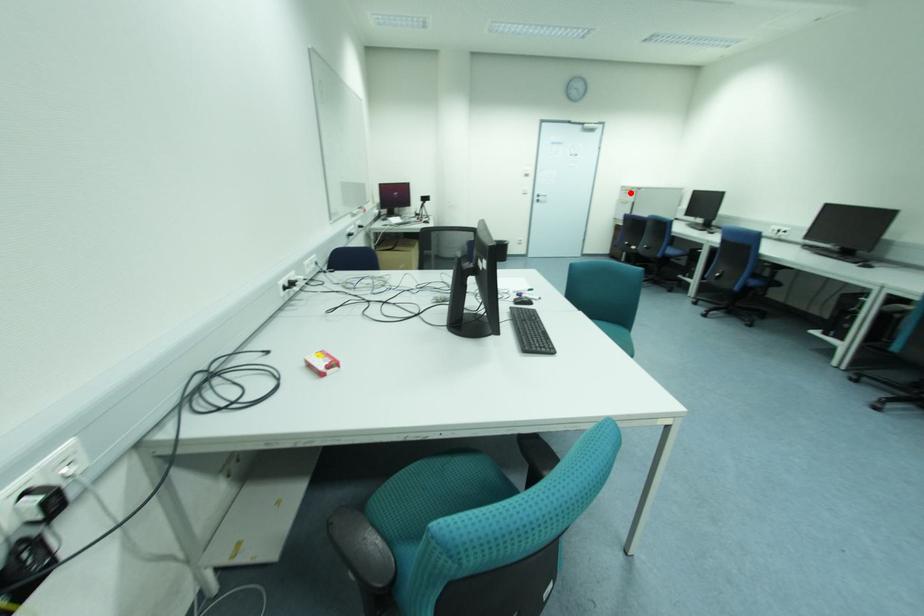
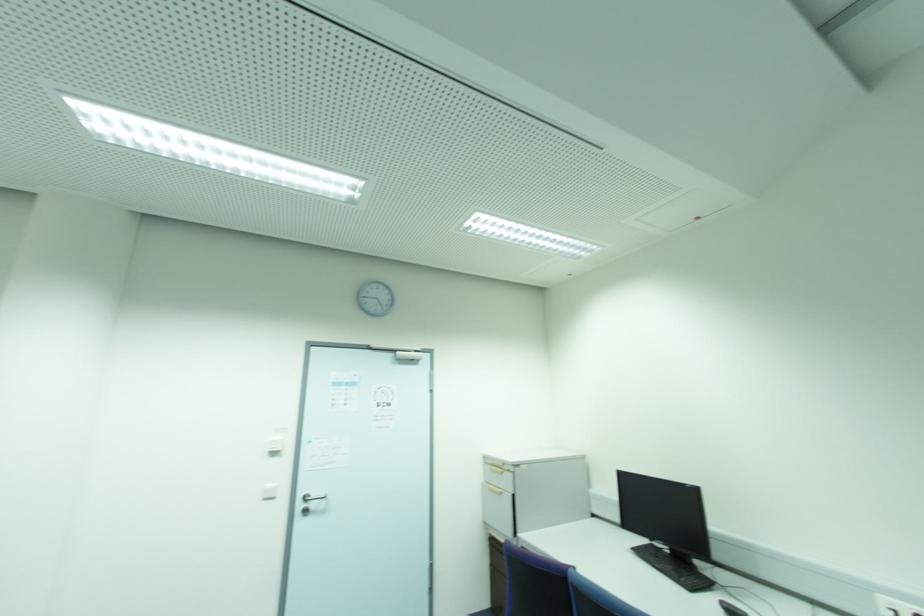
Question: I am providing you with two images of the same scene from different viewpoints. In image1, a red point is highlighted. Considering the same 3D point in image2, which of the following is correct?

Choices:
 (A) It is closer
 (B) It is farther

Answer: (B)